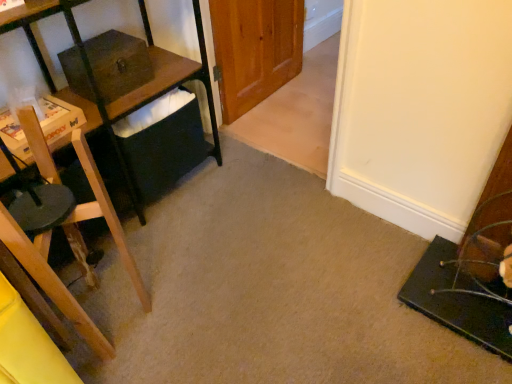
Where is `vacant space to the right of wooden chair at left`? This screenshot has width=512, height=384. vacant space to the right of wooden chair at left is located at coordinates (178, 311).